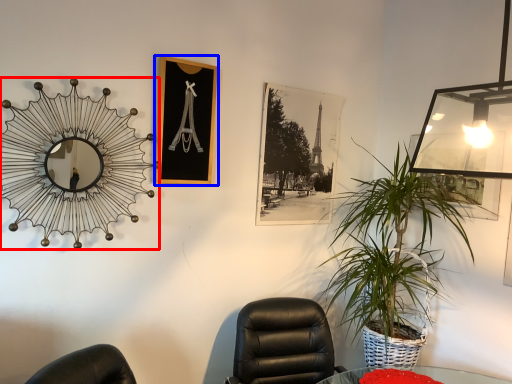
Question: Which point is further to the camera, mirror (highlighted by a red box) or picture frame (highlighted by a blue box)?

Choices:
 (A) mirror
 (B) picture frame

Answer: (B)